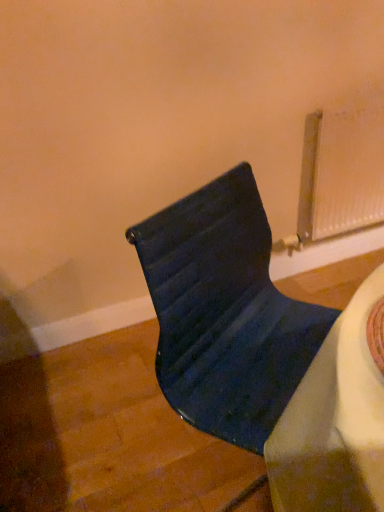
In order to click on vacant space situated on the left part of glossy dark blue chair at center in this screenshot , I will do `click(112, 436)`.